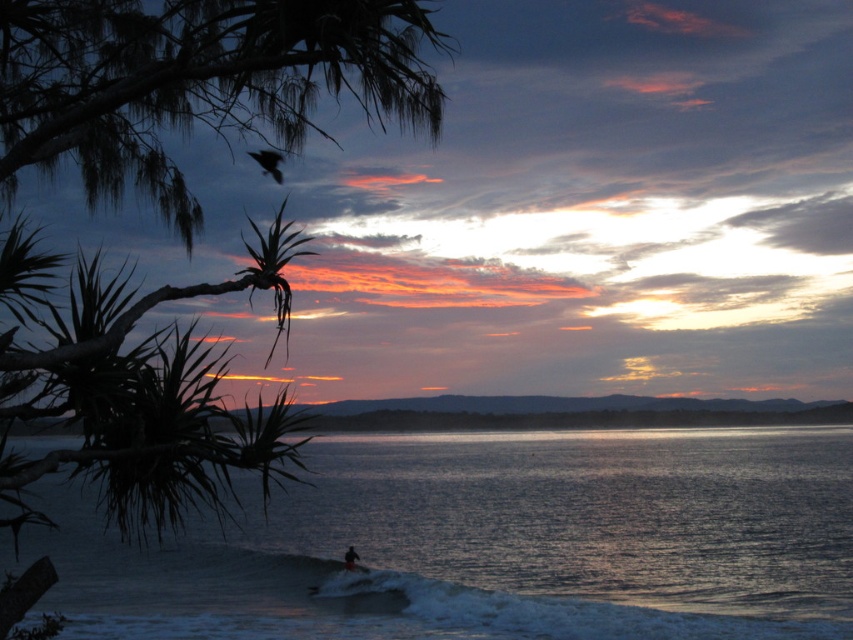
Question: Is black matte surfboard at lower center wider than white foam surfboard at lower center?

Choices:
 (A) no
 (B) yes

Answer: (A)

Question: Is clear water at center positioned behind green leafy tree at upper left?

Choices:
 (A) yes
 (B) no

Answer: (A)

Question: Among these points, which one is farthest from the camera?

Choices:
 (A) (347, 563)
 (B) (343, 45)
 (C) (520, 538)
 (D) (354, 561)

Answer: (C)

Question: Which is farther from the green leafy tree at upper left?

Choices:
 (A) white foam surfboard at lower center
 (B) black matte surfboard at lower center

Answer: (B)

Question: Which object is the closest to the white foam surfboard at lower center?

Choices:
 (A) green leafy tree at upper left
 (B) black matte surfboard at lower center

Answer: (B)

Question: Is clear water at center smaller than white foam surfboard at lower center?

Choices:
 (A) yes
 (B) no

Answer: (B)